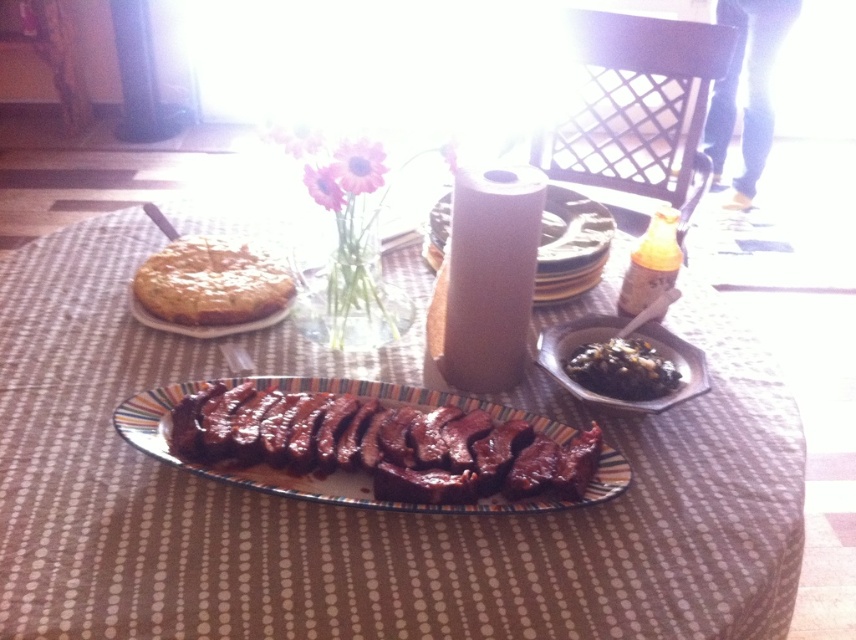
You are a guest at the table and want to reach for the smokey brown meat at center and the glossy ceramic platter at center. Which one is closer to your left side?

The smokey brown meat at center is to the left of the glossy ceramic platter at center, so it is closer to your left side.

You are a guest at a dinner party and want to place your napkin on the table. You need to choose between placing it on the black glossy bowl at center or the yellow cake at upper left. Which object has a smaller width, making it better suited for placing your napkin?

The black glossy bowl at center has a lesser width compared to the yellow cake at upper left, so it is better suited for placing your napkin.